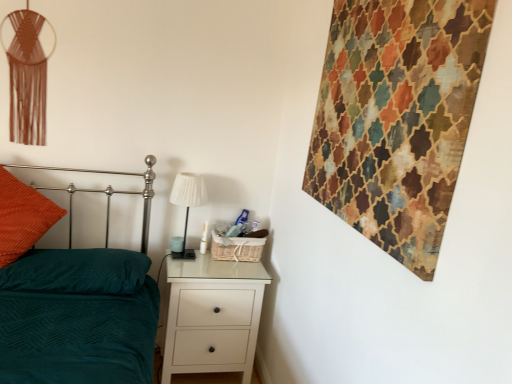
Question: Does white glossy chest of drawers at lower center come in front of teal fabric pillow at lower left?

Choices:
 (A) yes
 (B) no

Answer: (B)

Question: Are white glossy chest of drawers at lower center and teal fabric pillow at lower left making contact?

Choices:
 (A) yes
 (B) no

Answer: (B)

Question: Considering the relative sizes of white glossy chest of drawers at lower center and teal fabric pillow at lower left in the image provided, is white glossy chest of drawers at lower center bigger than teal fabric pillow at lower left?

Choices:
 (A) yes
 (B) no

Answer: (A)

Question: From a real-world perspective, is white glossy chest of drawers at lower center on teal fabric pillow at lower left?

Choices:
 (A) yes
 (B) no

Answer: (B)

Question: Can you confirm if white glossy chest of drawers at lower center is wider than teal fabric pillow at lower left?

Choices:
 (A) yes
 (B) no

Answer: (B)

Question: From the image's perspective, is textured multicolored tapestry at upper right above or below orange textured pillow at left?

Choices:
 (A) above
 (B) below

Answer: (A)

Question: Visually, is textured multicolored tapestry at upper right positioned to the left or to the right of orange textured pillow at left?

Choices:
 (A) right
 (B) left

Answer: (A)

Question: From a real-world perspective, is textured multicolored tapestry at upper right physically located above or below orange textured pillow at left?

Choices:
 (A) above
 (B) below

Answer: (A)

Question: Is textured multicolored tapestry at upper right taller or shorter than orange textured pillow at left?

Choices:
 (A) short
 (B) tall

Answer: (B)

Question: Is white fabric lampshade at center wider or thinner than white glossy chest of drawers at lower center?

Choices:
 (A) wide
 (B) thin

Answer: (B)

Question: Is white fabric lampshade at center in front of or behind white glossy chest of drawers at lower center in the image?

Choices:
 (A) front
 (B) behind

Answer: (B)

Question: From the image's perspective, relative to white glossy chest of drawers at lower center, is white fabric lampshade at center above or below?

Choices:
 (A) above
 (B) below

Answer: (A)

Question: Would you say white fabric lampshade at center is to the left or to the right of white glossy chest of drawers at lower center in the picture?

Choices:
 (A) right
 (B) left

Answer: (B)

Question: From the image's perspective, relative to teal fabric bed at left, is orange textured pillow at left above or below?

Choices:
 (A) above
 (B) below

Answer: (A)

Question: In terms of height, does orange textured pillow at left look taller or shorter compared to teal fabric bed at left?

Choices:
 (A) short
 (B) tall

Answer: (A)